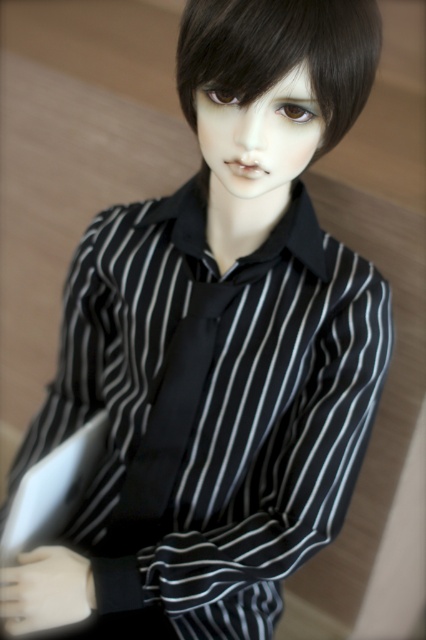
Question: Can you confirm if black silky hair at center is positioned to the left of black satin tie at center?

Choices:
 (A) no
 (B) yes

Answer: (A)

Question: Among these points, which one is nearest to the camera?

Choices:
 (A) (322, 80)
 (B) (140, 496)

Answer: (A)

Question: Can you confirm if black silky hair at center is wider than black satin tie at center?

Choices:
 (A) yes
 (B) no

Answer: (A)

Question: Which point is farther to the camera?

Choices:
 (A) (195, 128)
 (B) (132, 518)

Answer: (B)

Question: Which point is farther to the camera?

Choices:
 (A) black satin tie at center
 (B) black silky hair at center

Answer: (A)

Question: Does black silky hair at center appear under black satin tie at center?

Choices:
 (A) no
 (B) yes

Answer: (A)